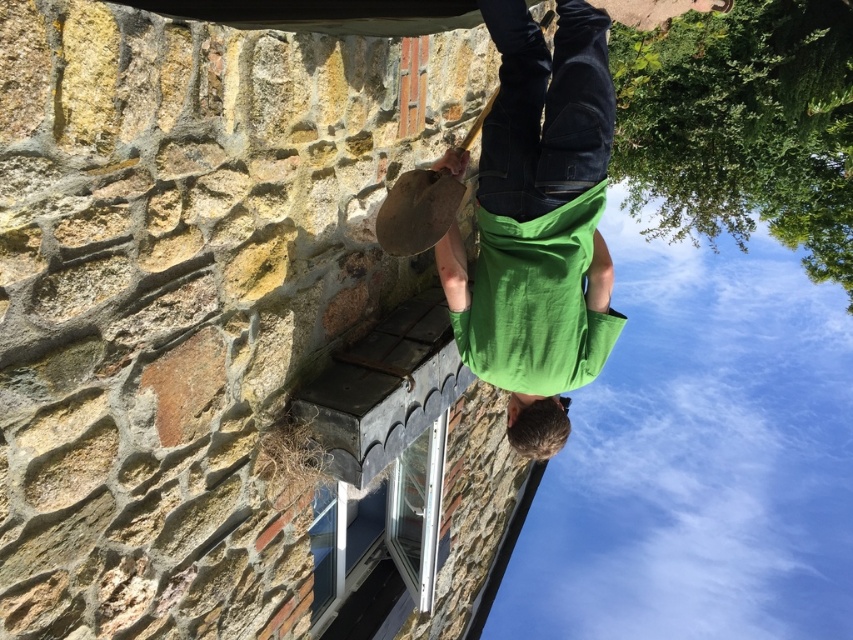
Is green matte skateboard at center thinner than white plastic window at lower center?

Incorrect, green matte skateboard at center's width is not less than white plastic window at lower center's.

Is point (596, 134) closer to camera compared to point (437, 529)?

Yes, it is in front of point (437, 529).

You are a GUI agent. You are given a task and a screenshot of the screen. Output one action in this format:
    pyautogui.click(x=<x>, y=<y>)
    Task: Click on the green matte skateboard at center
    The image size is (853, 640).
    Given the screenshot: What is the action you would take?
    pyautogui.click(x=538, y=221)